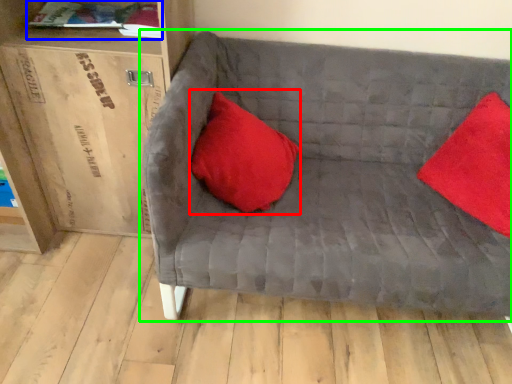
Question: Considering the real-world distances, which object is farthest from pillow (highlighted by a red box)? book (highlighted by a blue box) or studio couch (highlighted by a green box)?

Choices:
 (A) book
 (B) studio couch

Answer: (A)